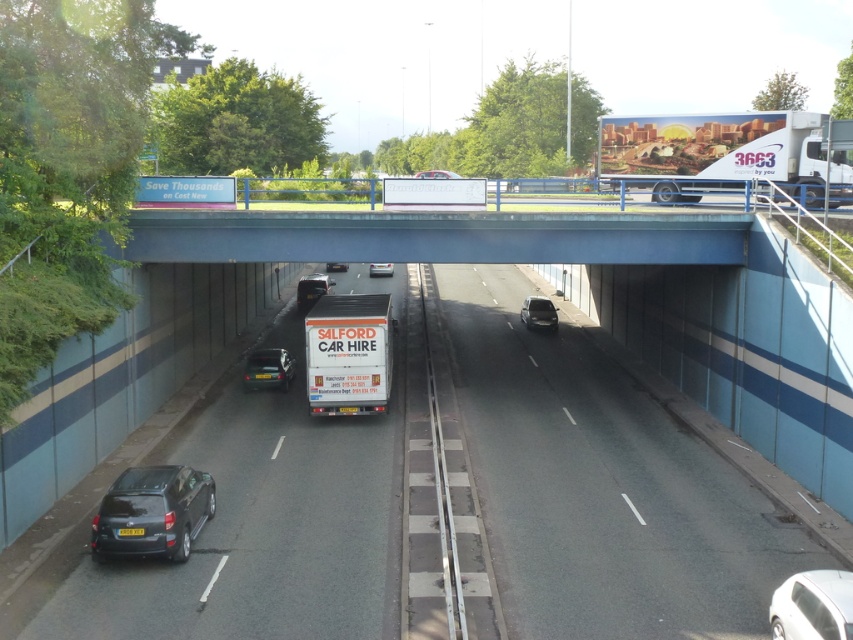
Which is below, white glossy sedan at lower right or white matte van at center?

Positioned lower is white glossy sedan at lower right.

Can you confirm if white glossy sedan at lower right is positioned below white matte van at center?

Correct, white glossy sedan at lower right is located below white matte van at center.

Identify the location of white glossy sedan at lower right. The width and height of the screenshot is (853, 640). (811, 605).

Does white glossy truck at upper center appear under dark gray matte hatchback at lower left?

No, white glossy truck at upper center is not below dark gray matte hatchback at lower left.

Can you confirm if white glossy truck at upper center is positioned above dark gray matte hatchback at lower left?

Correct, white glossy truck at upper center is located above dark gray matte hatchback at lower left.

You are a GUI agent. You are given a task and a screenshot of the screen. Output one action in this format:
    pyautogui.click(x=<x>, y=<y>)
    Task: Click on the white glossy truck at upper center
    
    Given the screenshot: What is the action you would take?
    pyautogui.click(x=728, y=154)

Is point (762, 614) less distant than point (334, 266)?

Yes.

Measure the distance between asphalt road at center and white matte van at center.

asphalt road at center and white matte van at center are 12.01 meters apart.

Does point (602, 472) come in front of point (325, 264)?

Yes, it is in front of point (325, 264).

Locate an element on the screen. The width and height of the screenshot is (853, 640). asphalt road at center is located at coordinates (602, 484).